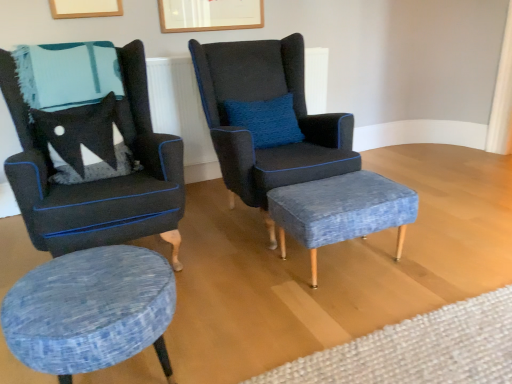
Identify the location of free space between blue fabric stool at center, which appears as the 1th stool when viewed from the right, and white textured rug at lower right, marked as the 1th plain in a back-to-front arrangement. (347, 306).